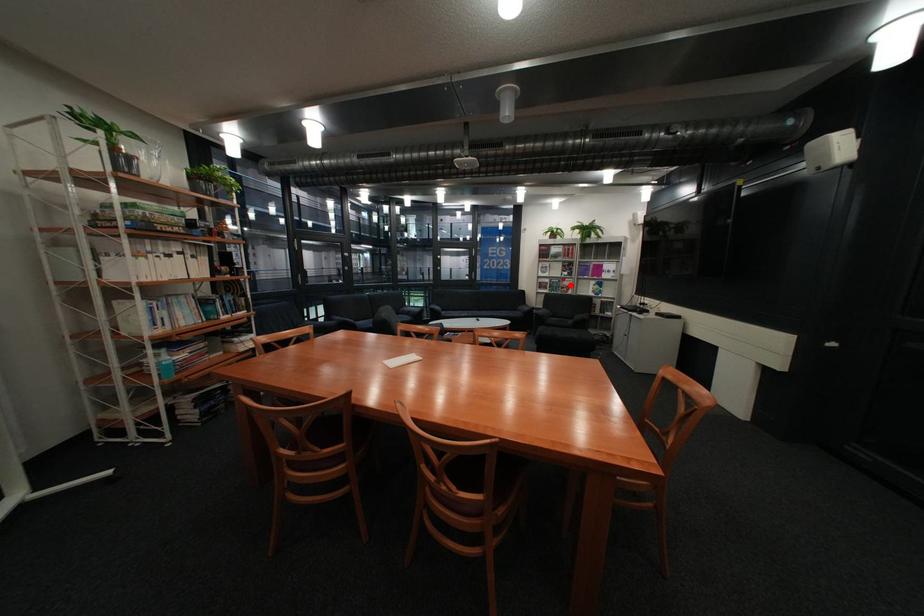
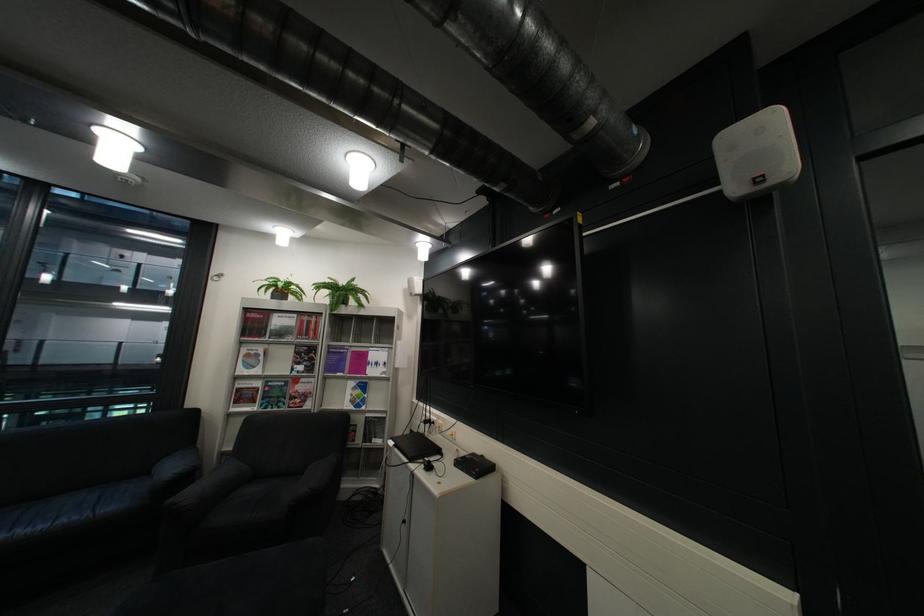
Question: A red point is marked in image1. In image2, is the corresponding 3D point closer to the camera or farther? Reply with the corresponding letter.

Choices:
 (A) The corresponding 3D point is closer.
 (B) The corresponding 3D point is farther.

Answer: (B)